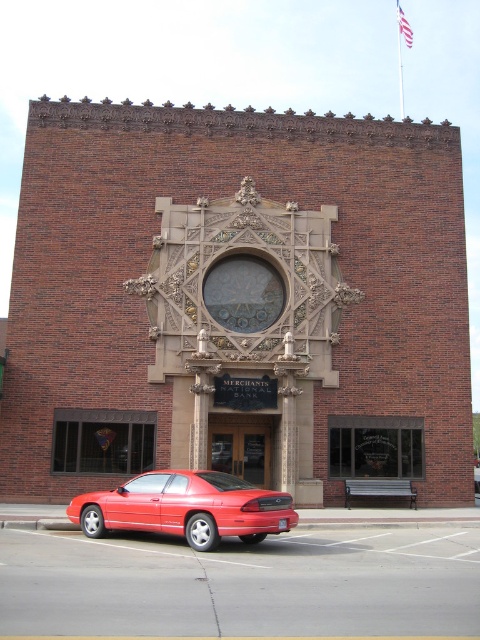
You are standing in front of the brick building and want to park your car. The glossy red car at lower left is currently blocking the entrance. Can you move your car behind the metallic bench at lower center without going around the building?

The glossy red car at lower left is located above the metallic bench at lower center, so moving the car behind the bench would require moving it downward, which might not be possible if the bench is in the way. However, since the bench is at lower center and the car is above it, you could potentially maneuver the car behind the bench by moving it to the right or left while staying behind the bench area.

You are a photographer wanting to capture both the glossy red car at lower left and the metallic bench at lower center in a single frame. Given their sizes, which object should you position closer to the camera to ensure both are clearly visible in the photo?

Since the glossy red car at lower left is larger than the metallic bench at lower center, positioning the metallic bench at lower center closer to the camera will help balance their sizes in the frame, ensuring both are clearly visible.